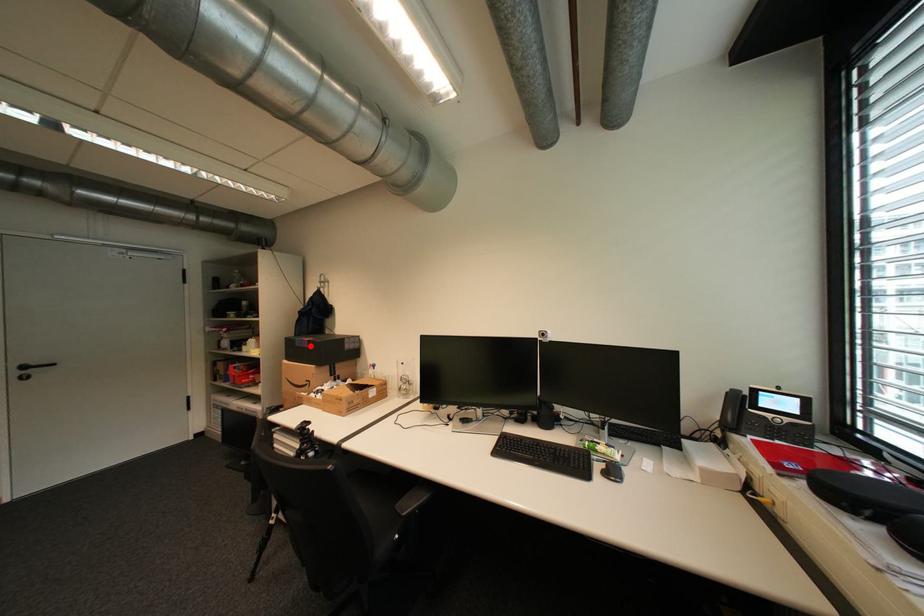
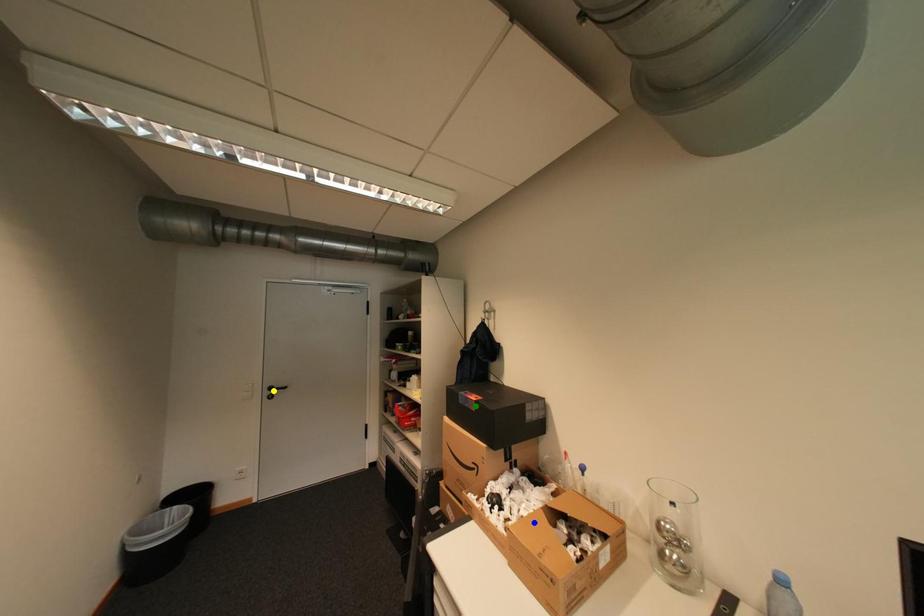
Question: I am providing you with two images of the same scene from different viewpoints. A red point is marked on the first image. You are given multiple points on the second image. Which point in image 2 is actually the same real-world point as the red point in image 1?

Choices:
 (A) blue point
 (B) yellow point
 (C) green point

Answer: (C)